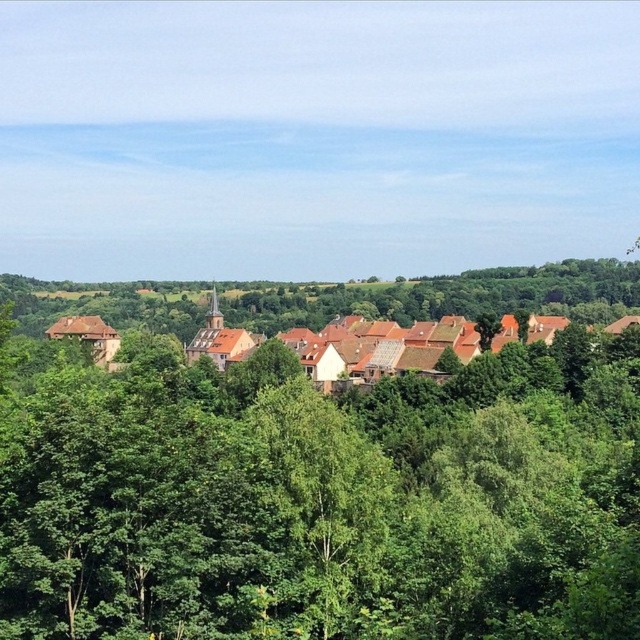
Question: Does green leafy tree at center have a smaller size compared to brown clay houses at center?

Choices:
 (A) yes
 (B) no

Answer: (A)

Question: Is green leafy tree at center above brown clay houses at center?

Choices:
 (A) no
 (B) yes

Answer: (A)

Question: Which point is closer to the camera taking this photo?

Choices:
 (A) (99, 342)
 (B) (612, 410)

Answer: (B)

Question: Among these objects, which one is nearest to the camera?

Choices:
 (A) green leafy tree at center
 (B) brown clay houses at center

Answer: (A)

Question: Is the position of green leafy tree at center more distant than that of brown clay houses at center?

Choices:
 (A) no
 (B) yes

Answer: (A)